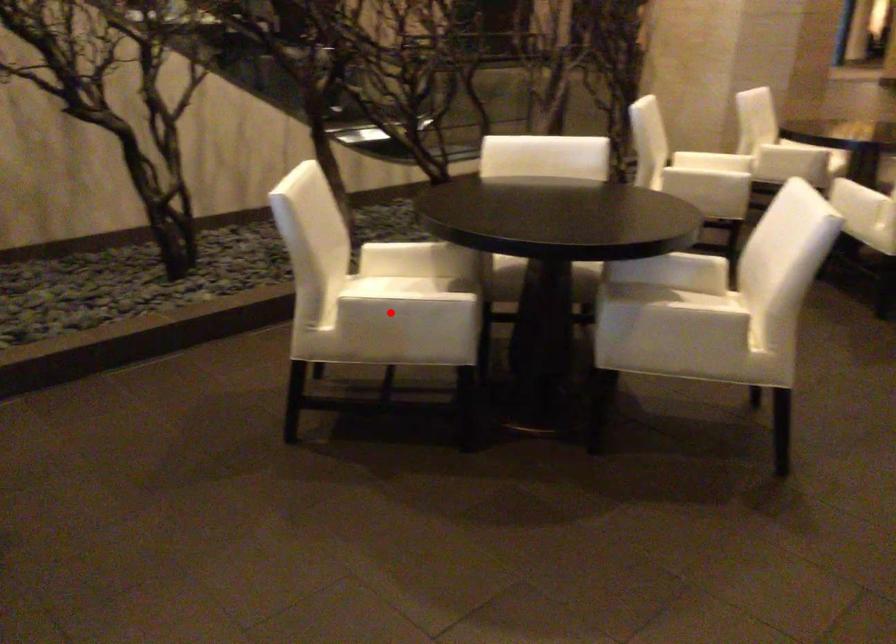
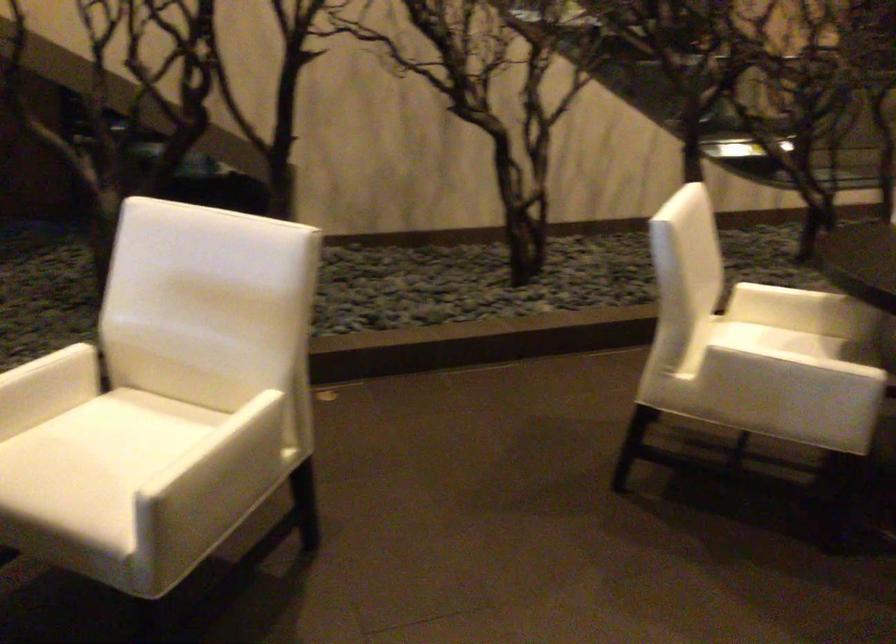
Question: I am providing you with two images of the same scene from different viewpoints. A red point is marked on the first image. Is the red point's position out of view in image 2?

Choices:
 (A) Yes
 (B) No

Answer: (B)